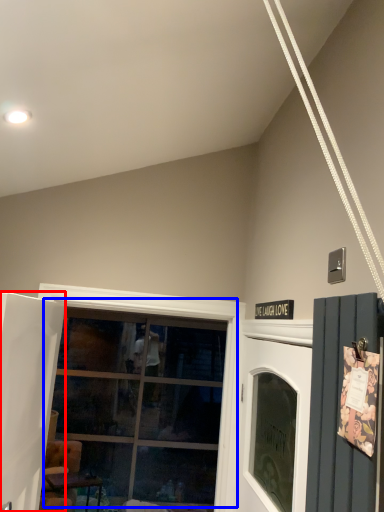
Question: Among these objects, which one is farthest to the camera, door (highlighted by a red box) or window (highlighted by a blue box)?

Choices:
 (A) door
 (B) window

Answer: (B)